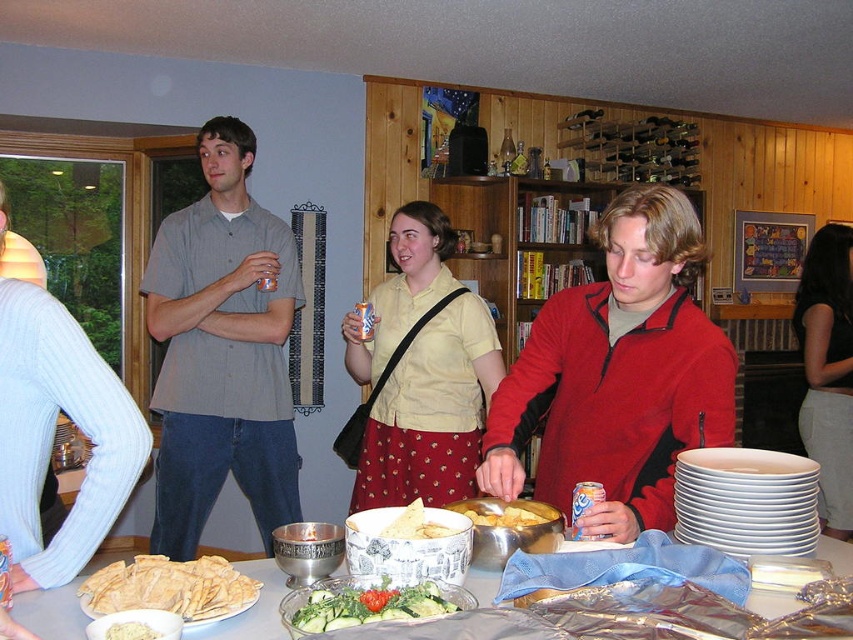
Question: Does yellow cotton shirt at center have a larger size compared to golden tortilla chips at center?

Choices:
 (A) yes
 (B) no

Answer: (A)

Question: Considering the real-world distances, which object is farthest from the cable-knit sweater at left?

Choices:
 (A) white matte bowl at center
 (B) golden tortilla chips at center

Answer: (A)

Question: Which point is closer to the camera?

Choices:
 (A) green leafy salad at center
 (B) light gray cotton shorts at lower right

Answer: (A)

Question: Is matte red jacket at center closer to the viewer compared to cable-knit sweater at left?

Choices:
 (A) no
 (B) yes

Answer: (A)

Question: Is light gray cotton shorts at lower right further to the viewer compared to white matte bowl at center?

Choices:
 (A) yes
 (B) no

Answer: (A)

Question: Based on their relative distances, which object is farther from the cable-knit sweater at left?

Choices:
 (A) yellow cotton shirt at center
 (B) matte red jacket at center
 (C) light gray cotton shorts at lower right

Answer: (C)